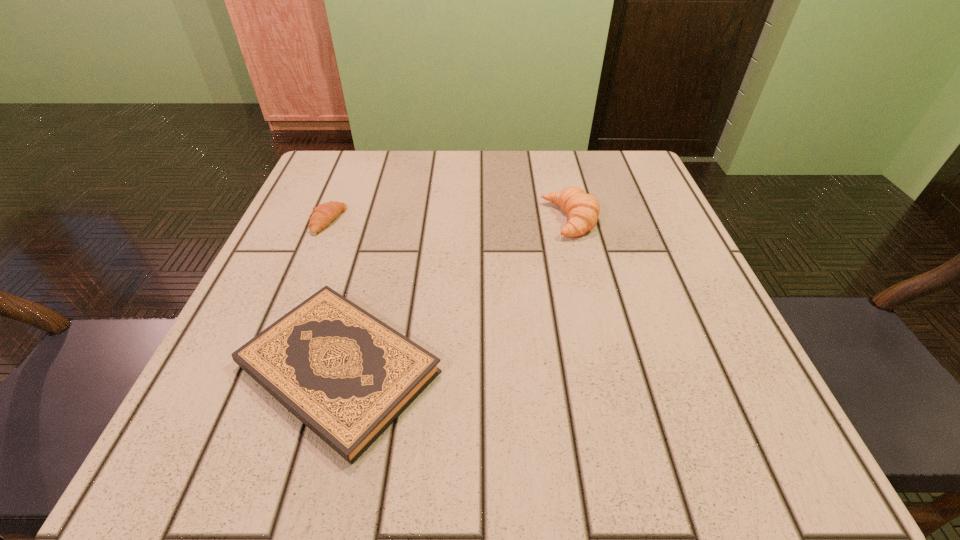
Where is `the taller crescent roll`? The width and height of the screenshot is (960, 540). the taller crescent roll is located at coordinates (583, 209).

Locate an element on the screen. the right crescent roll is located at coordinates (583, 209).

Identify the location of the left crescent roll. This screenshot has height=540, width=960. (322, 215).

The width and height of the screenshot is (960, 540). What are the coordinates of `hardback book` in the screenshot? It's located at (345, 374).

The height and width of the screenshot is (540, 960). Find the location of `free space located on the front of the right crescent roll`. free space located on the front of the right crescent roll is located at coordinates (591, 308).

The image size is (960, 540). What are the coordinates of `free space located 0.070m on the back of the left crescent roll` in the screenshot? It's located at (341, 188).

The width and height of the screenshot is (960, 540). I want to click on vacant space situated 0.290m on the right of the nearest object, so click(x=645, y=369).

At what (x,y) coordinates should I click in order to perform the action: click on object at the near edge. Please return your answer as a coordinate pair (x, y). Looking at the image, I should click on (345, 374).

You are a GUI agent. You are given a task and a screenshot of the screen. Output one action in this format:
    pyautogui.click(x=<x>, y=<y>)
    Task: Click on the crescent roll present at the left edge
    The image size is (960, 540).
    Given the screenshot: What is the action you would take?
    pyautogui.click(x=322, y=215)

This screenshot has width=960, height=540. Find the location of `hardback book present at the left edge`. hardback book present at the left edge is located at coordinates (345, 374).